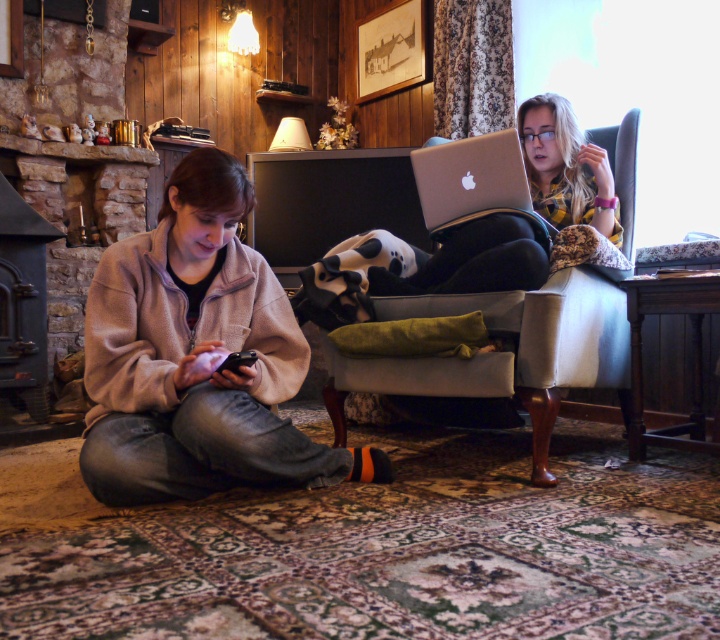
Between beige fleece jacket at lower left and silver metallic laptop at upper right, which one appears on the right side from the viewer's perspective?

beige fleece jacket at lower left is more to the right.

Is beige fleece jacket at lower left smaller than silver metallic laptop at upper right?

Incorrect, beige fleece jacket at lower left is not smaller in size than silver metallic laptop at upper right.

What do you see at coordinates (505, 355) in the screenshot? Image resolution: width=720 pixels, height=640 pixels. I see `beige fleece jacket at lower left` at bounding box center [505, 355].

The width and height of the screenshot is (720, 640). In order to click on beige fleece jacket at lower left in this screenshot , I will do `click(505, 355)`.

Is beige fleece jacket at lower left to the left of blonde hair at upper right from the viewer's perspective?

Correct, you'll find beige fleece jacket at lower left to the left of blonde hair at upper right.

You are a GUI agent. You are given a task and a screenshot of the screen. Output one action in this format:
    pyautogui.click(x=<x>, y=<y>)
    Task: Click on the beige fleece jacket at lower left
    
    Given the screenshot: What is the action you would take?
    pyautogui.click(x=505, y=355)

Which of these two, black cast iron fireplace at left or silver metallic laptop at upper right, stands taller?

black cast iron fireplace at left is taller.

Measure the distance from black cast iron fireplace at left to silver metallic laptop at upper right.

The distance of black cast iron fireplace at left from silver metallic laptop at upper right is 1.73 meters.

Is point (9, 362) more distant than point (463, 209)?

Yes, it is behind point (463, 209).

The height and width of the screenshot is (640, 720). What are the coordinates of `black cast iron fireplace at left` in the screenshot? It's located at (x=22, y=304).